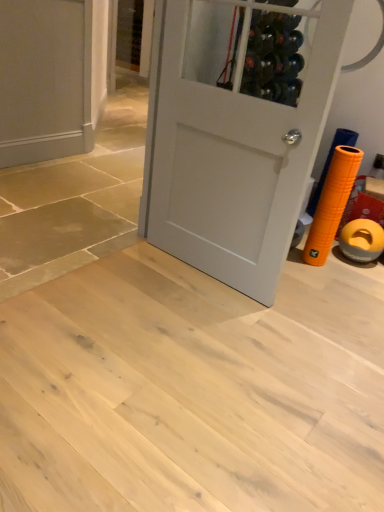
Question: Which direction should I rotate to look at white matte door at center, placed as the 1th door when sorted from right to left?

Choices:
 (A) left
 (B) right

Answer: (B)

Question: Is matte gray door at upper left, which is the second door from front to back, positioned in front of white matte door at center, the 2th door when ordered from left to right?

Choices:
 (A) yes
 (B) no

Answer: (B)

Question: Are matte gray door at upper left, which is the 1th door from left to right, and white matte door at center, the 2th door when ordered from left to right, far apart?

Choices:
 (A) no
 (B) yes

Answer: (B)

Question: Does matte gray door at upper left, the first door viewed from the back, come behind white matte door at center, which is the 2th door from back to front?

Choices:
 (A) yes
 (B) no

Answer: (A)

Question: Is white matte door at center, placed as the 1th door when sorted from right to left, inside matte gray door at upper left, which ranks as the 2th door in right-to-left order?

Choices:
 (A) yes
 (B) no

Answer: (B)

Question: From a real-world perspective, is matte gray door at upper left, the first door viewed from the back, physically below white matte door at center, the 2th door when ordered from left to right?

Choices:
 (A) yes
 (B) no

Answer: (A)

Question: Is matte gray door at upper left, the first door viewed from the back, facing towards white matte door at center, the 2th door when ordered from left to right?

Choices:
 (A) no
 (B) yes

Answer: (B)

Question: Is white matte door at center, placed as the 1th door when sorted from right to left, looking in the opposite direction of matte gray door at upper left, which is the second door from front to back?

Choices:
 (A) no
 (B) yes

Answer: (A)

Question: Is white matte door at center, which is the 1th door in front-to-back order, shorter than matte gray door at upper left, which is the 1th door from left to right?

Choices:
 (A) no
 (B) yes

Answer: (A)

Question: Is the position of white matte door at center, placed as the 1th door when sorted from right to left, more distant than that of matte gray door at upper left, the first door viewed from the back?

Choices:
 (A) no
 (B) yes

Answer: (A)

Question: Does white matte door at center, the 2th door when ordered from left to right, turn towards matte gray door at upper left, which ranks as the 2th door in right-to-left order?

Choices:
 (A) no
 (B) yes

Answer: (A)

Question: From a real-world perspective, is white matte door at center, which is the 2th door from back to front, located beneath matte gray door at upper left, the first door viewed from the back?

Choices:
 (A) no
 (B) yes

Answer: (A)

Question: From a real-world perspective, is white matte door at center, which is the 2th door from back to front, on matte gray door at upper left, the first door viewed from the back?

Choices:
 (A) no
 (B) yes

Answer: (B)

Question: Do you think matte gray door at upper left, the first door viewed from the back, is within white matte door at center, the 2th door when ordered from left to right, or outside of it?

Choices:
 (A) inside
 (B) outside

Answer: (B)